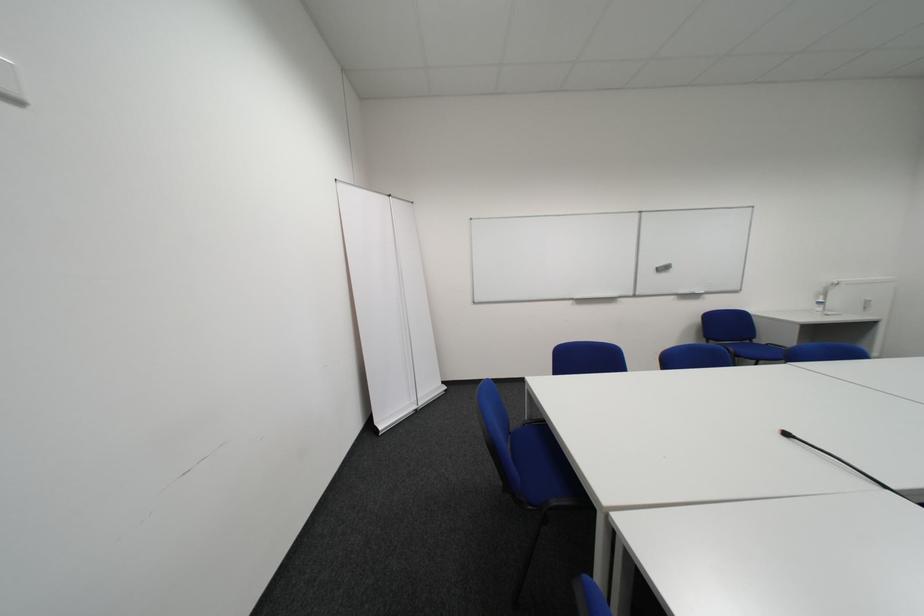
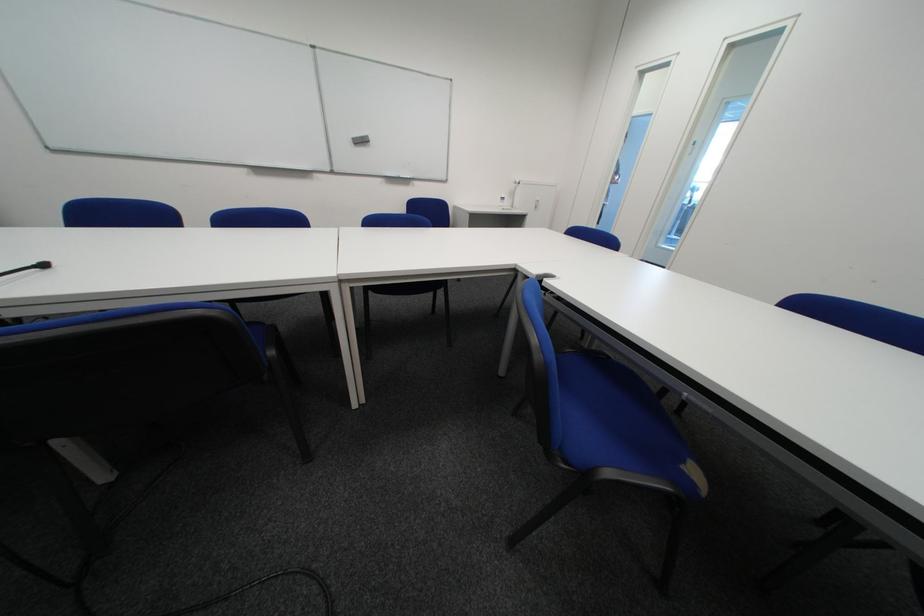
In the second image, find the point that corresponds to point 669,270 in the first image.

(365, 140)